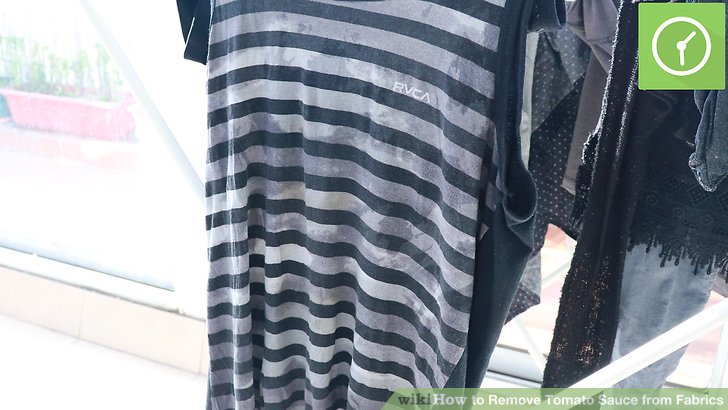
The image size is (728, 410). I want to click on window pane, so click(x=156, y=212).